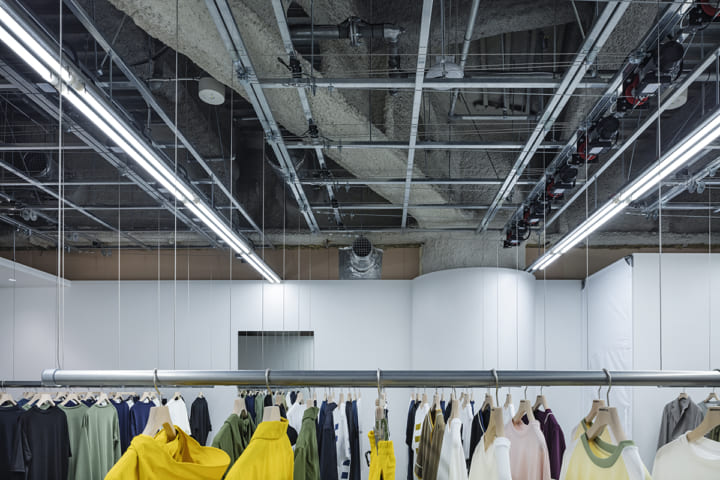
I want to click on lights, so click(567, 248).